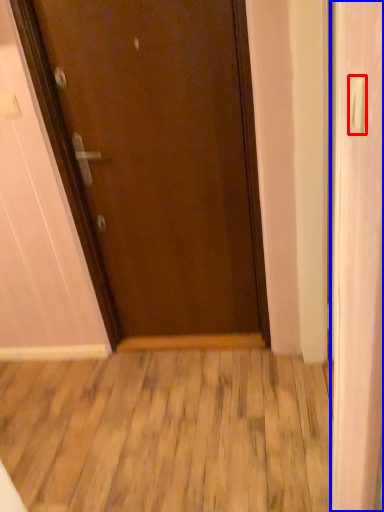
Question: Among these objects, which one is nearest to the camera, door handle (highlighted by a red box) or screen door (highlighted by a blue box)?

Choices:
 (A) door handle
 (B) screen door

Answer: (A)